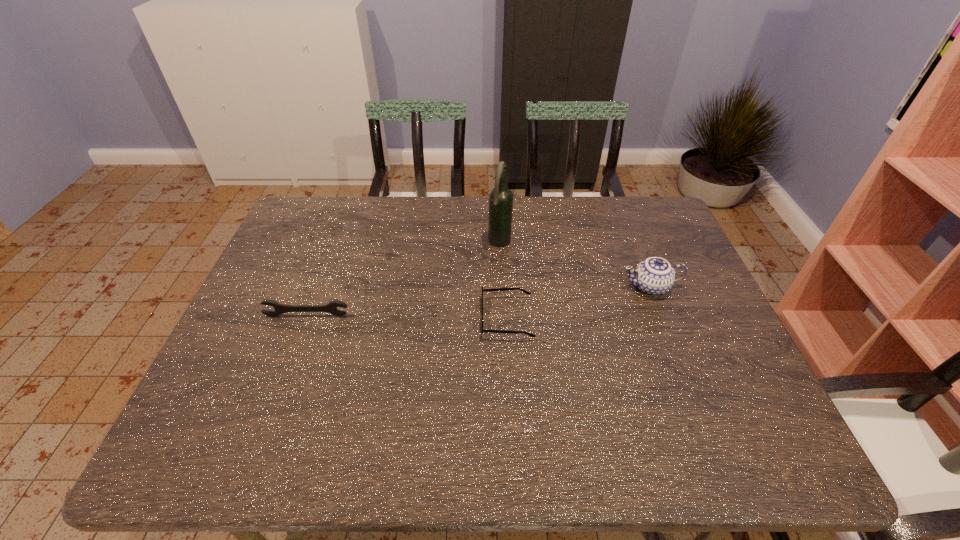
You are a GUI agent. You are given a task and a screenshot of the screen. Output one action in this format:
    pyautogui.click(x=<x>, y=<y>)
    Task: Click on the free space between the rightmost object and the sunglasses
    This screenshot has height=540, width=960.
    Given the screenshot: What is the action you would take?
    pyautogui.click(x=579, y=302)

Identify the location of empty space that is in between the sunglasses and the wrench. This screenshot has height=540, width=960. (407, 316).

Locate an element on the screen. free space between the rightmost object and the leftmost object is located at coordinates (478, 301).

What are the coordinates of `the closest object to the leftmost object` in the screenshot? It's located at (496, 289).

Select which object is the second closest to the third shortest object. Please provide its 2D coordinates. Your answer should be formatted as a tuple, i.e. [(x, y)], where the tuple contains the x and y coordinates of a point satisfying the conditions above.

[(501, 197)]

I want to click on vacant area that satisfies the following two spatial constraints: 1. from the spout of the rightmost object; 2. on the open ends of the wrench, so click(x=661, y=315).